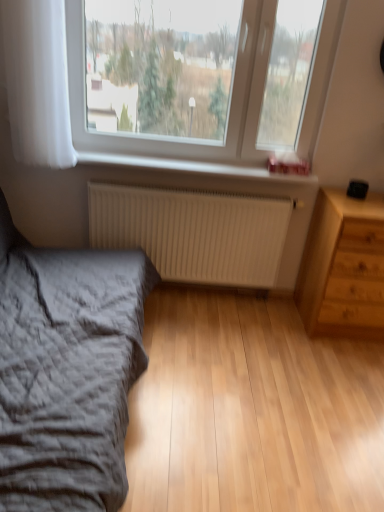
This screenshot has width=384, height=512. What are the coordinates of `free point to the right of white matte radiator at lower center` in the screenshot? It's located at (279, 332).